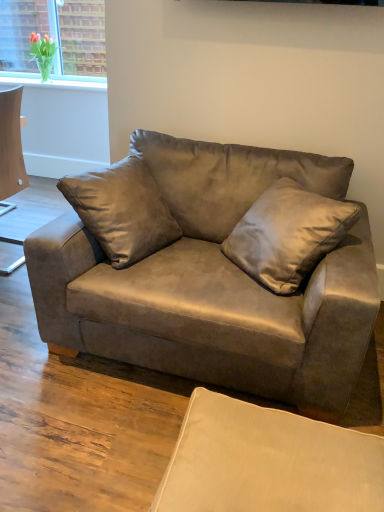
Find the location of a particular element. The height and width of the screenshot is (512, 384). vacant area situated to the left side of beige fabric swivel chair at lower right is located at coordinates (107, 436).